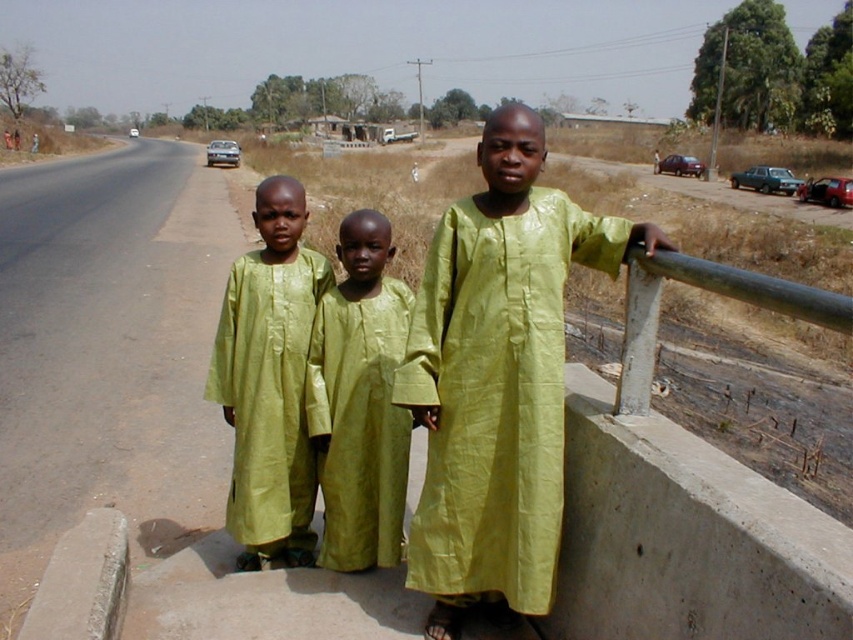
Between lime green silk robe at right and green shiny dress at center, which one has more height?

Standing taller between the two is green shiny dress at center.

Between lime green silk robe at right and green shiny dress at center, which one appears on the right side from the viewer's perspective?

lime green silk robe at right

The image size is (853, 640). Identify the location of lime green silk robe at right. (495, 396).

You are a GUI agent. You are given a task and a screenshot of the screen. Output one action in this format:
    pyautogui.click(x=<x>, y=<y>)
    Task: Click on the lime green silk robe at right
    Image resolution: width=853 pixels, height=640 pixels.
    Given the screenshot: What is the action you would take?
    tap(495, 396)

Can you confirm if matte green dress at center is smaller than green shiny dress at center?

Indeed, matte green dress at center has a smaller size compared to green shiny dress at center.

Image resolution: width=853 pixels, height=640 pixels. What do you see at coordinates (270, 380) in the screenshot? I see `matte green dress at center` at bounding box center [270, 380].

Identify the location of matte green dress at center. (270, 380).

The width and height of the screenshot is (853, 640). Find the location of `matte green dress at center`. matte green dress at center is located at coordinates 270,380.

Who is lower down, lime green silk robe at right or matte green dress at center?

lime green silk robe at right is below.

Is lime green silk robe at right to the right of matte green dress at center from the viewer's perspective?

Correct, you'll find lime green silk robe at right to the right of matte green dress at center.

Which is behind, point (553, 307) or point (296, 420)?

Point (296, 420)

This screenshot has height=640, width=853. I want to click on lime green silk robe at right, so click(x=495, y=396).